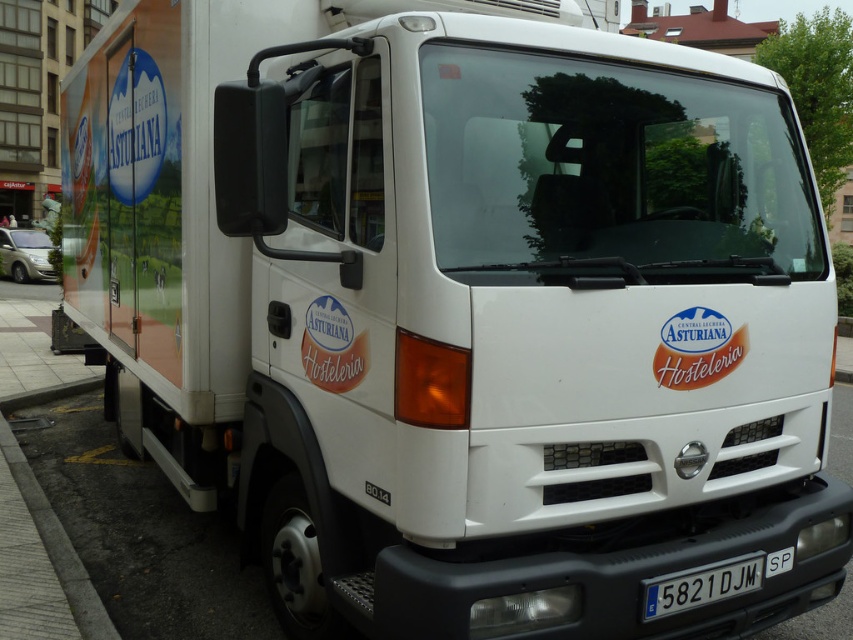
In the scene shown: Can you confirm if gray concrete curb at lower left is positioned above black plastic license plate at bottom center?

No, gray concrete curb at lower left is not above black plastic license plate at bottom center.

In the scene shown: Who is more distant from viewer, (x=67, y=566) or (x=740, y=570)?

Positioned behind is point (x=67, y=566).

Where is `gray concrete curb at lower left`? gray concrete curb at lower left is located at coordinates (54, 515).

In order to click on gray concrete curb at lower left in this screenshot , I will do `click(54, 515)`.

Who is more forward, (727, 573) or (21, 266)?

Point (727, 573)

Between black plastic license plate at bottom center and matte silver van at left, which one is positioned lower?

black plastic license plate at bottom center is below.

Is point (662, 582) farther from camera compared to point (32, 272)?

No, (662, 582) is closer to viewer.

Where is `black plastic license plate at bottom center`? The width and height of the screenshot is (853, 640). black plastic license plate at bottom center is located at coordinates (701, 588).

Does point (28, 506) come farther from viewer compared to point (44, 273)?

No, (28, 506) is closer to viewer.

Is gray concrete curb at lower left taller than matte silver van at left?

No.

This screenshot has height=640, width=853. I want to click on gray concrete curb at lower left, so point(54,515).

Locate an element on the screen. gray concrete curb at lower left is located at coordinates [54, 515].